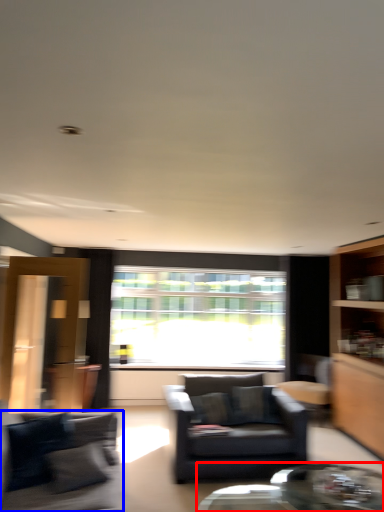
Question: Which point is closer to the camera, coffee table (highlighted by a red box) or studio couch (highlighted by a blue box)?

Choices:
 (A) coffee table
 (B) studio couch

Answer: (B)